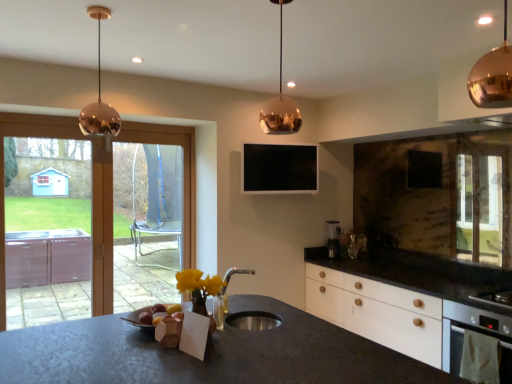
You are a GUI agent. You are given a task and a screenshot of the screen. Output one action in this format:
    pyautogui.click(x=<x>, y=<y>)
    Task: Click on the free space above copper/metallic pendant light at upper left, which is the third lamp from front to back (from a real-world perspective)
    The height and width of the screenshot is (384, 512).
    Given the screenshot: What is the action you would take?
    click(x=103, y=9)